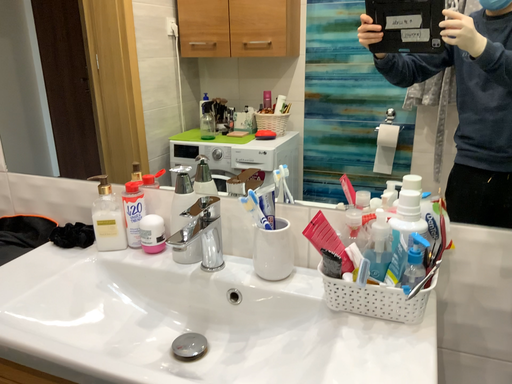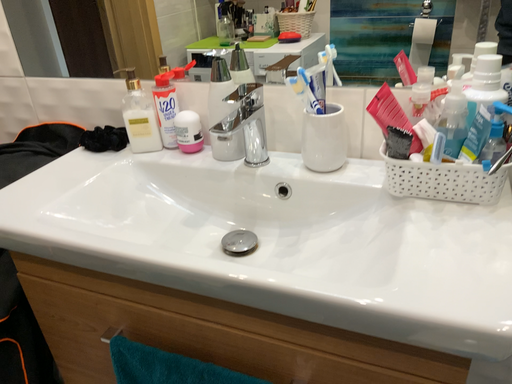
Question: Which way did the camera rotate in the video?

Choices:
 (A) rotated downward
 (B) rotated upward

Answer: (A)